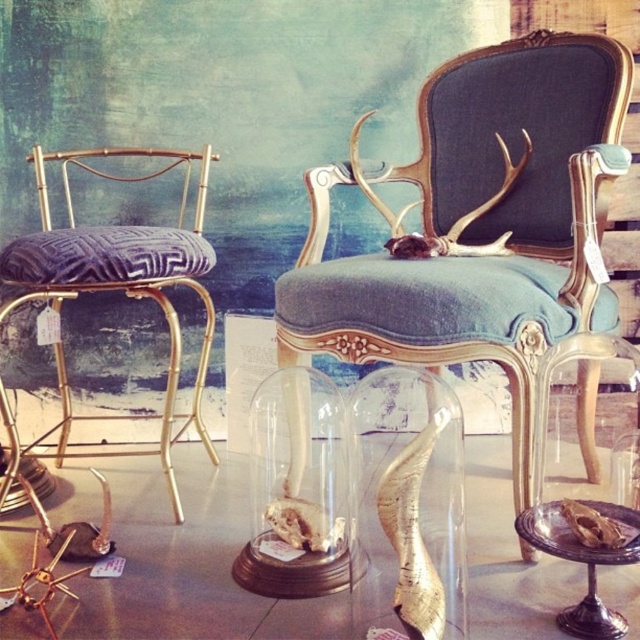
Question: Does gold wood armchair with antlers at center come behind transparent glass table at center?

Choices:
 (A) no
 (B) yes

Answer: (B)

Question: Does gold wood armchair with antlers at center lie in front of gold metallic stool at left?

Choices:
 (A) no
 (B) yes

Answer: (B)

Question: Is gold wood armchair with antlers at center thinner than transparent glass table at center?

Choices:
 (A) no
 (B) yes

Answer: (B)

Question: Which object is positioned closest to the transparent glass table at center?

Choices:
 (A) transparent glass skull at lower right
 (B) gold metallic stool at left

Answer: (A)

Question: Which object is the closest to the transparent glass table at center?

Choices:
 (A) gold wood armchair with antlers at center
 (B) transparent glass skull at lower right

Answer: (B)

Question: Which point is farther from the camera taking this photo?

Choices:
 (A) (90, 618)
 (B) (515, 499)
 (C) (77, 253)

Answer: (C)